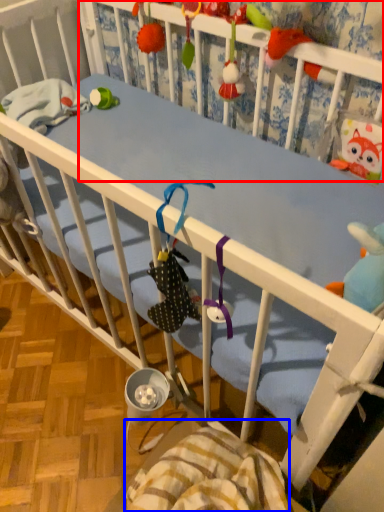
Question: Which object appears farthest to the camera in this image, infant bed (highlighted by a red box) or blanket (highlighted by a blue box)?

Choices:
 (A) infant bed
 (B) blanket

Answer: (A)